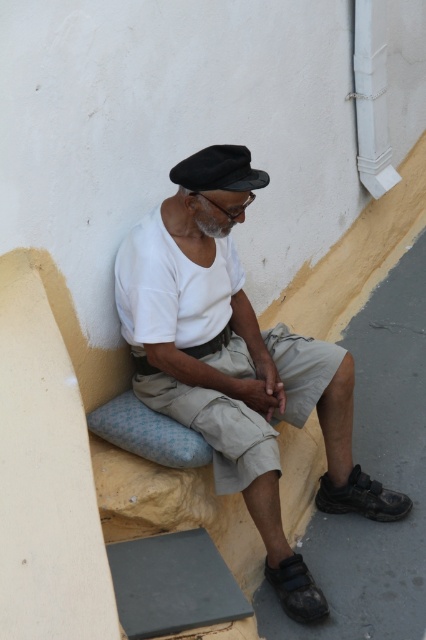
Question: Can you confirm if white cotton shirt at center is thinner than black felt cap at upper center?

Choices:
 (A) yes
 (B) no

Answer: (B)

Question: Does white cotton shirt at center have a smaller size compared to black felt cap at upper center?

Choices:
 (A) yes
 (B) no

Answer: (B)

Question: In this image, where is white cotton shirt at center located relative to black felt cap at upper center?

Choices:
 (A) above
 (B) below

Answer: (B)

Question: Which of the following is the closest to the observer?

Choices:
 (A) [172, 176]
 (B) [219, 442]

Answer: (A)